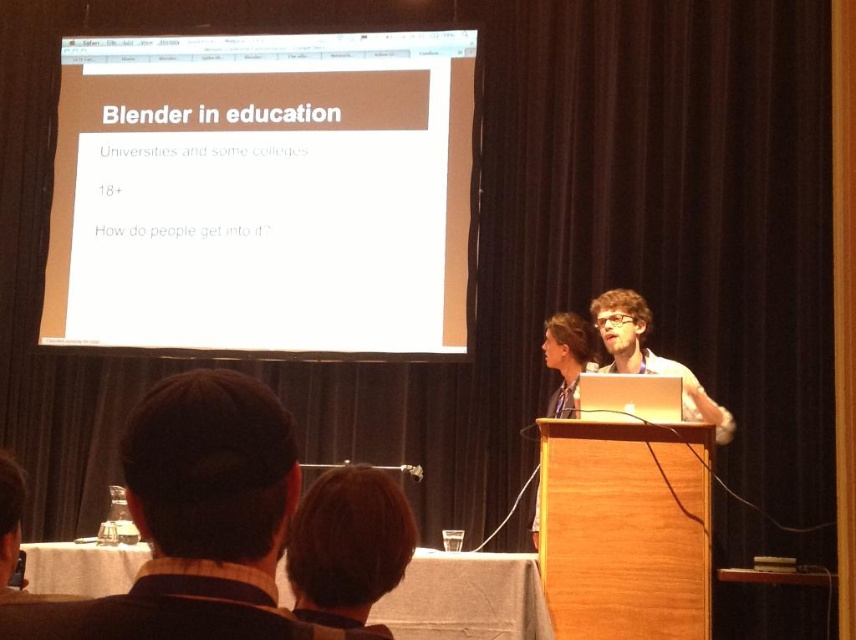
Question: Is dark brown hair at lower center thinner than matte white laptop at center?

Choices:
 (A) no
 (B) yes

Answer: (B)

Question: Can you confirm if white paper at upper center is smaller than dark brown hair at lower center?

Choices:
 (A) no
 (B) yes

Answer: (A)

Question: Estimate the real-world distances between objects in this image. Which object is farther from the matte black hair at center?

Choices:
 (A) white paper at upper center
 (B) matte white laptop at center

Answer: (A)

Question: Which point appears closest to the camera in this image?

Choices:
 (A) (311, 156)
 (B) (611, 337)

Answer: (B)

Question: Does white paper at upper center appear under matte white laptop at center?

Choices:
 (A) yes
 (B) no

Answer: (B)

Question: Which of the following is the closest to the observer?

Choices:
 (A) (272, 540)
 (B) (544, 358)
 (C) (226, 58)

Answer: (A)